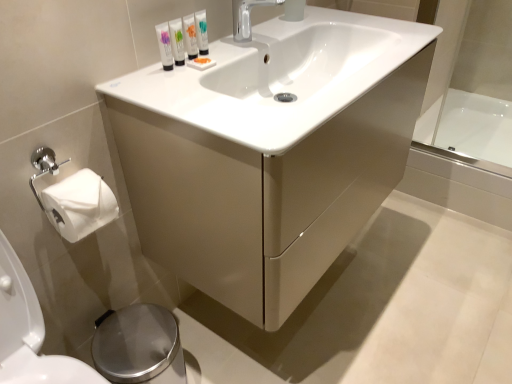
Identify the location of free space in front of translucent plastic tubes at upper center, the second mouthwash from the left. Image resolution: width=512 pixels, height=384 pixels. (182, 89).